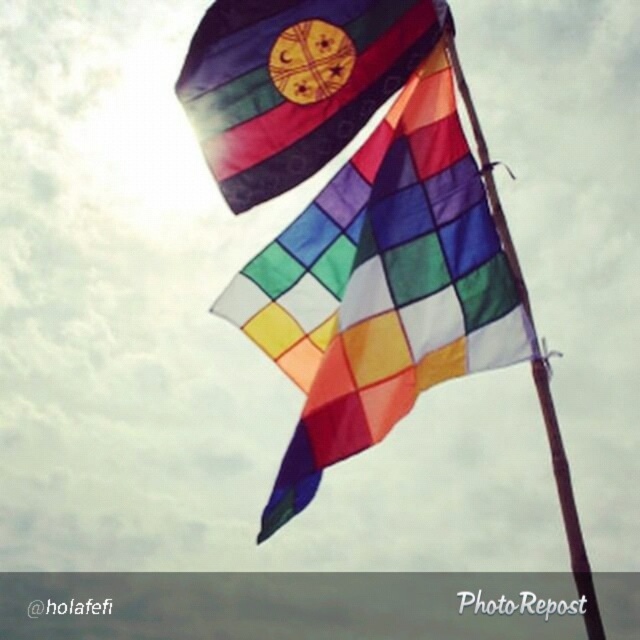
Question: Can you confirm if multicolored fabric kite at center is positioned above brown wooden pole at center?

Choices:
 (A) no
 (B) yes

Answer: (A)

Question: Which of the following is the farthest from the observer?

Choices:
 (A) click(x=552, y=404)
 (B) click(x=321, y=145)

Answer: (B)

Question: Does multicolored fabric kite at center appear over brown wooden pole at center?

Choices:
 (A) no
 (B) yes

Answer: (A)

Question: Estimate the real-world distances between objects in this image. Which object is closer to the multicolored fabric kite at center?

Choices:
 (A) textured fabric flag at upper center
 (B) brown wooden pole at center

Answer: (B)

Question: Is multicolored fabric kite at center to the left of brown wooden pole at center from the viewer's perspective?

Choices:
 (A) yes
 (B) no

Answer: (A)

Question: Which point is closer to the camera taking this photo?

Choices:
 (A) (269, 266)
 (B) (573, 556)

Answer: (B)